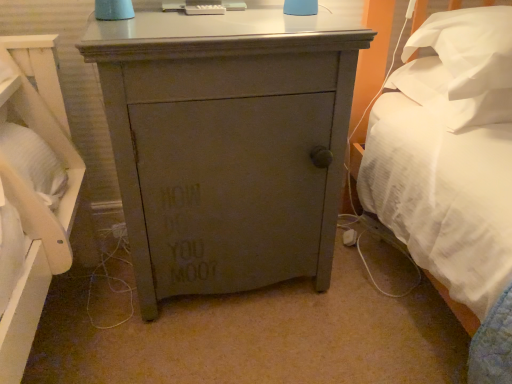
What do you see at coordinates (469, 48) in the screenshot?
I see `white soft pillow at upper right, the first pillow in the top-to-bottom sequence` at bounding box center [469, 48].

What do you see at coordinates (448, 96) in the screenshot? I see `white soft pillow at upper right, the 2th pillow when ordered from top to bottom` at bounding box center [448, 96].

Locate an element on the screen. matte gray cabinet at center is located at coordinates (x=227, y=144).

Is white soft pillow at upper right, marked as the second pillow in a bottom-to-top arrangement, in contact with white soft pillow at upper right, the 2th pillow when ordered from top to bottom?

No, white soft pillow at upper right, marked as the second pillow in a bottom-to-top arrangement, is not touching white soft pillow at upper right, the 2th pillow when ordered from top to bottom.

From a real-world perspective, is white soft pillow at upper right, the first pillow in the top-to-bottom sequence, positioned under white soft pillow at upper right, the 2th pillow when ordered from top to bottom, based on gravity?

No, from a real-world perspective, white soft pillow at upper right, the first pillow in the top-to-bottom sequence, is not beneath white soft pillow at upper right, the 2th pillow when ordered from top to bottom.

Considering the sizes of objects matte gray cabinet at center and white soft pillow at upper right, marked as the second pillow in a bottom-to-top arrangement, in the image provided, who is bigger, matte gray cabinet at center or white soft pillow at upper right, marked as the second pillow in a bottom-to-top arrangement,?

matte gray cabinet at center.

Relative to white soft pillow at upper right, the first pillow in the top-to-bottom sequence, is matte gray cabinet at center in front or behind?

matte gray cabinet at center is in front of white soft pillow at upper right, the first pillow in the top-to-bottom sequence.

Is matte gray cabinet at center situated inside white soft pillow at upper right, the first pillow in the top-to-bottom sequence, or outside?

matte gray cabinet at center is spatially situated outside white soft pillow at upper right, the first pillow in the top-to-bottom sequence.

Which is in front, point (234, 208) or point (464, 96)?

The point (464, 96) is more forward.

Looking at this image, does white soft pillow at upper right, the 2th pillow when ordered from top to bottom, turn towards white soft pillow at upper right, marked as the second pillow in a bottom-to-top arrangement?

No, white soft pillow at upper right, the 2th pillow when ordered from top to bottom, is not aimed at white soft pillow at upper right, marked as the second pillow in a bottom-to-top arrangement.

I want to click on pillow above the white soft pillow at upper right, the 1th pillow when ordered from bottom to top (from a real-world perspective), so click(469, 48).

Is white soft pillow at upper right, the 1th pillow when ordered from bottom to top, next to white soft pillow at upper right, marked as the second pillow in a bottom-to-top arrangement, and touching it?

No, white soft pillow at upper right, the 1th pillow when ordered from bottom to top, is not with white soft pillow at upper right, marked as the second pillow in a bottom-to-top arrangement.

Looking at this image, considering the positions of objects white soft pillow at upper right, the 1th pillow when ordered from bottom to top, and white soft pillow at upper right, marked as the second pillow in a bottom-to-top arrangement, in the image provided, who is in front, white soft pillow at upper right, the 1th pillow when ordered from bottom to top, or white soft pillow at upper right, marked as the second pillow in a bottom-to-top arrangement,?

white soft pillow at upper right, marked as the second pillow in a bottom-to-top arrangement.

Is matte gray cabinet at center placed right next to white soft pillow at upper right, the 2th pillow when ordered from top to bottom?

No, matte gray cabinet at center is not in contact with white soft pillow at upper right, the 2th pillow when ordered from top to bottom.

From a real-world perspective, is matte gray cabinet at center physically below white soft pillow at upper right, the 2th pillow when ordered from top to bottom?

Correct, in the physical world, matte gray cabinet at center is lower than white soft pillow at upper right, the 2th pillow when ordered from top to bottom.

Which of these two, matte gray cabinet at center or white soft pillow at upper right, the 2th pillow when ordered from top to bottom, is wider?

matte gray cabinet at center is wider.

Considering the relative sizes of matte gray cabinet at center and white soft pillow at upper right, the 2th pillow when ordered from top to bottom, in the image provided, is matte gray cabinet at center taller than white soft pillow at upper right, the 2th pillow when ordered from top to bottom,?

Yes, matte gray cabinet at center is taller than white soft pillow at upper right, the 2th pillow when ordered from top to bottom.

Locate an element on the screen. This screenshot has width=512, height=384. the chest of drawers that appears below the white soft pillow at upper right, the first pillow in the top-to-bottom sequence (from a real-world perspective) is located at coordinates (227, 144).

Is the depth of white soft pillow at upper right, the first pillow in the top-to-bottom sequence, less than that of matte gray cabinet at center?

No, white soft pillow at upper right, the first pillow in the top-to-bottom sequence, is further to the viewer.

In the scene shown: Could you tell me if white soft pillow at upper right, the first pillow in the top-to-bottom sequence, is facing matte gray cabinet at center?

No, white soft pillow at upper right, the first pillow in the top-to-bottom sequence, is not turned towards matte gray cabinet at center.

From the picture: Between white soft pillow at upper right, the first pillow in the top-to-bottom sequence, and matte gray cabinet at center, which one has more height?

With more height is matte gray cabinet at center.

Considering the relative sizes of white soft pillow at upper right, the 2th pillow when ordered from top to bottom, and matte gray cabinet at center in the image provided, is white soft pillow at upper right, the 2th pillow when ordered from top to bottom, smaller than matte gray cabinet at center?

Indeed, white soft pillow at upper right, the 2th pillow when ordered from top to bottom, has a smaller size compared to matte gray cabinet at center.

How different are the orientations of white soft pillow at upper right, the 1th pillow when ordered from bottom to top, and matte gray cabinet at center in degrees?

The angular difference between white soft pillow at upper right, the 1th pillow when ordered from bottom to top, and matte gray cabinet at center is 1.62 degrees.

From the image's perspective, is white soft pillow at upper right, the 2th pillow when ordered from top to bottom, above matte gray cabinet at center?

Correct, white soft pillow at upper right, the 2th pillow when ordered from top to bottom, appears higher than matte gray cabinet at center in the image.

Where is `pillow located behind the white soft pillow at upper right, the first pillow in the top-to-bottom sequence`? Image resolution: width=512 pixels, height=384 pixels. pillow located behind the white soft pillow at upper right, the first pillow in the top-to-bottom sequence is located at coordinates (448, 96).

Where is `the 2nd pillow positioned above the matte gray cabinet at center (from a real-world perspective)`? the 2nd pillow positioned above the matte gray cabinet at center (from a real-world perspective) is located at coordinates (469, 48).

Estimate the real-world distances between objects in this image. Which object is further from matte gray cabinet at center, white soft pillow at upper right, the 2th pillow when ordered from top to bottom, or white soft pillow at upper right, the first pillow in the top-to-bottom sequence?

Based on the image, white soft pillow at upper right, the 2th pillow when ordered from top to bottom, appears to be further to matte gray cabinet at center.

Estimate the real-world distances between objects in this image. Which object is closer to matte gray cabinet at center, white soft pillow at upper right, marked as the second pillow in a bottom-to-top arrangement, or white soft pillow at upper right, the 1th pillow when ordered from bottom to top?

The object closer to matte gray cabinet at center is white soft pillow at upper right, marked as the second pillow in a bottom-to-top arrangement.

From the image, which object appears to be farther from white soft pillow at upper right, the first pillow in the top-to-bottom sequence, white soft pillow at upper right, the 2th pillow when ordered from top to bottom, or matte gray cabinet at center?

The object further to white soft pillow at upper right, the first pillow in the top-to-bottom sequence, is matte gray cabinet at center.

Looking at the image, which one is located closer to white soft pillow at upper right, the 1th pillow when ordered from bottom to top, white soft pillow at upper right, marked as the second pillow in a bottom-to-top arrangement, or matte gray cabinet at center?

white soft pillow at upper right, marked as the second pillow in a bottom-to-top arrangement.

When comparing their distances from white soft pillow at upper right, marked as the second pillow in a bottom-to-top arrangement, does matte gray cabinet at center or white soft pillow at upper right, the 2th pillow when ordered from top to bottom, seem closer?

white soft pillow at upper right, the 2th pillow when ordered from top to bottom.

Considering their positions, is matte gray cabinet at center positioned further to white soft pillow at upper right, the 1th pillow when ordered from bottom to top, than white soft pillow at upper right, marked as the second pillow in a bottom-to-top arrangement?

matte gray cabinet at center.

The image size is (512, 384). What are the coordinates of `pillow between matte gray cabinet at center and white soft pillow at upper right, the first pillow in the top-to-bottom sequence, in the horizontal direction` in the screenshot? It's located at (448, 96).